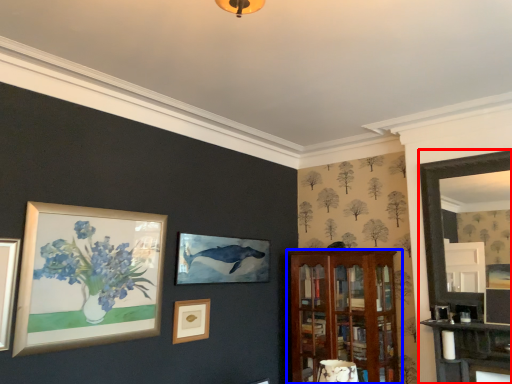
Question: Which point is closer to the camera, fireplace (highlighted by a red box) or shelf (highlighted by a blue box)?

Choices:
 (A) fireplace
 (B) shelf

Answer: (A)